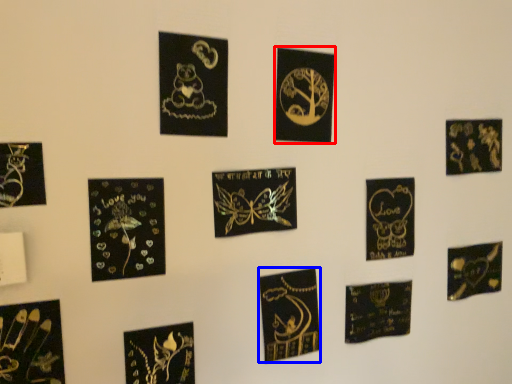
Question: Which object is further to the camera taking this photo, picture frame (highlighted by a red box) or embroidery (highlighted by a blue box)?

Choices:
 (A) picture frame
 (B) embroidery

Answer: (B)